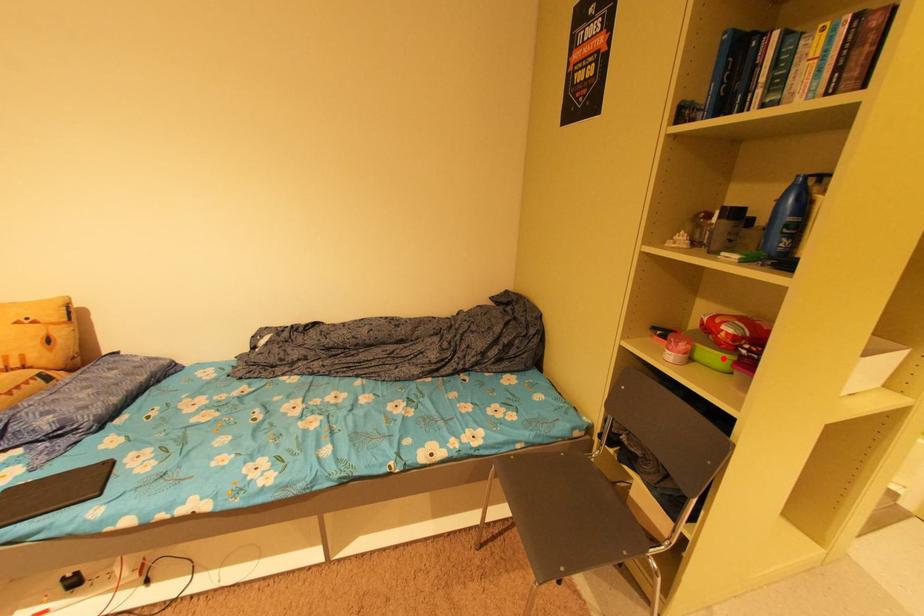
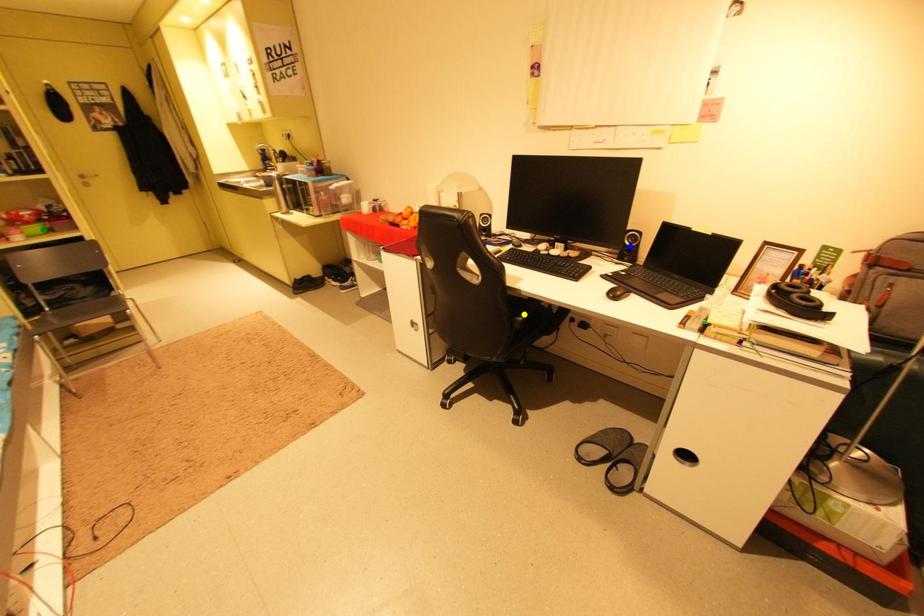
Question: I am providing you with two images of the same scene from different viewpoints. A red point is marked on the first image. You are given multiple points on the second image. Which mark in image 2 goes with the point in image 1?

Choices:
 (A) blue point
 (B) yellow point
 (C) green point

Answer: (C)